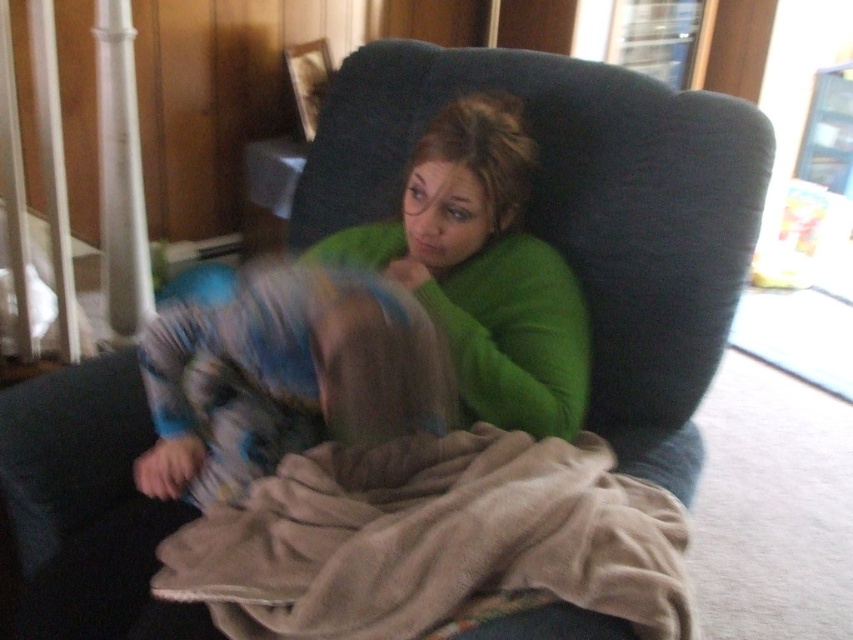
Is green soft sweater at center thinner than blue and white fabric at center?

No, green soft sweater at center is not thinner than blue and white fabric at center.

Who is more forward, (473, 378) or (215, 452)?

Point (215, 452) is more forward.

Which is behind, point (216, 486) or point (201, 397)?

Positioned behind is point (216, 486).

Find the location of a particular element. The image size is (853, 640). green soft sweater at center is located at coordinates (483, 269).

Can you confirm if beige soft blanket at center is shorter than blue and white fabric at center?

Correct, beige soft blanket at center is not as tall as blue and white fabric at center.

Which is behind, point (624, 493) or point (245, 312)?

The point (624, 493) is behind.

At what (x,y) coordinates should I click in order to perform the action: click on beige soft blanket at center. Please return your answer as a coordinate pair (x, y). Image resolution: width=853 pixels, height=640 pixels. Looking at the image, I should click on (433, 540).

This screenshot has width=853, height=640. What are the coordinates of `beige soft blanket at center` in the screenshot? It's located at (433, 540).

Is beige soft blanket at center bigger than green soft sweater at center?

Actually, beige soft blanket at center might be smaller than green soft sweater at center.

Is point (296, 608) positioned in front of point (138, 360)?

Yes, point (296, 608) is closer to viewer.

I want to click on beige soft blanket at center, so click(x=433, y=540).